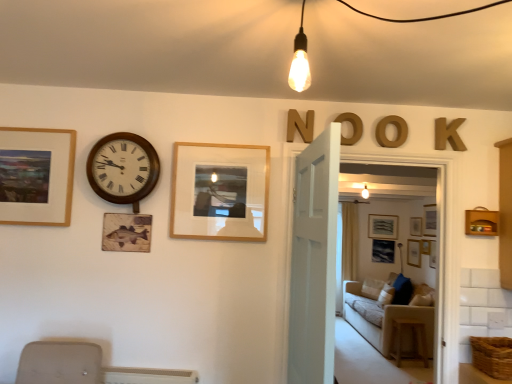
Question: In the image, is wooden frame at center, placed as the second picture frame when sorted from top to bottom, positioned in front of or behind wooden at right?

Choices:
 (A) behind
 (B) front

Answer: (B)

Question: In terms of size, does wooden frame at center, the 3th picture frame viewed from the right, appear bigger or smaller than wooden at right?

Choices:
 (A) big
 (B) small

Answer: (B)

Question: Considering the real-world distances, which object is farthest from the brown wooden letter k at upper right, the first letter viewed from the right?

Choices:
 (A) beige fabric couch at center
 (B) wooden at right
 (C) gold metallic letter at upper center, the second letter viewed from the left
 (D) matte black picture frame at center, the 2th picture frame in the back-to-front sequence
 (E) matte gray picture frame at center, placed as the 4th picture frame when sorted from front to back

Answer: (D)

Question: Which object is the closest to the brown wooden letter k at upper right, the first letter viewed from the right?

Choices:
 (A) gold metallic letter o at upper center, which is the 3th letter in left-to-right order
 (B) wooden frame at center, which is the second picture frame in left-to-right order
 (C) matte wooden picture frame at left, the first picture frame when ordered from left to right
 (D) wooden at right
 (E) transparent glass door at center

Answer: (A)